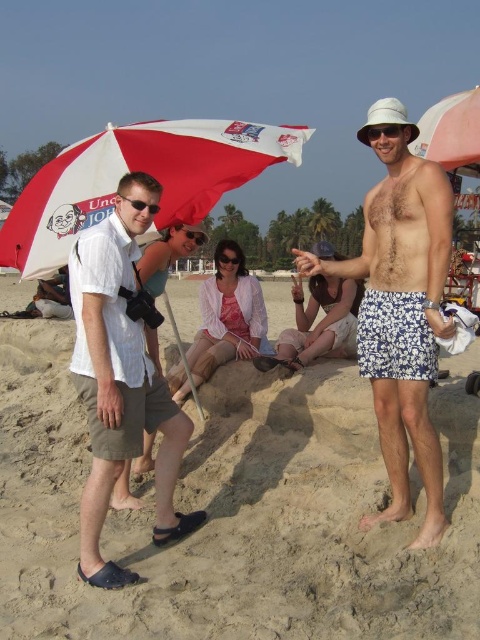
Which is below, white fabric umbrella at upper right or white matte bucket hat at upper center?

white matte bucket hat at upper center is below.

Can you confirm if white fabric umbrella at upper right is wider than white matte bucket hat at upper center?

Yes, white fabric umbrella at upper right is wider than white matte bucket hat at upper center.

Between point (477, 125) and point (400, 131), which one is positioned in front?

Point (400, 131) is more forward.

Where is `white fabric umbrella at upper right`? This screenshot has width=480, height=640. white fabric umbrella at upper right is located at coordinates (x=452, y=132).

This screenshot has width=480, height=640. What do you see at coordinates (120, 385) in the screenshot? I see `white cotton shirt at left` at bounding box center [120, 385].

Does white cotton shirt at left have a lesser height compared to black plastic goggles at center?

In fact, white cotton shirt at left may be taller than black plastic goggles at center.

Is point (120, 221) positioned behind point (186, 227)?

That is False.

Locate an element on the screen. white cotton shirt at left is located at coordinates (120, 385).

Is brown sandy beach at lower center smaller than black plastic goggles at center?

No.

Can you confirm if brown sandy beach at lower center is bigger than black plastic goggles at center?

Indeed, brown sandy beach at lower center has a larger size compared to black plastic goggles at center.

Between point (23, 376) and point (202, 237), which one is positioned behind?

The point (23, 376) is more distant.

In order to click on brown sandy beach at lower center in this screenshot , I will do `click(236, 513)`.